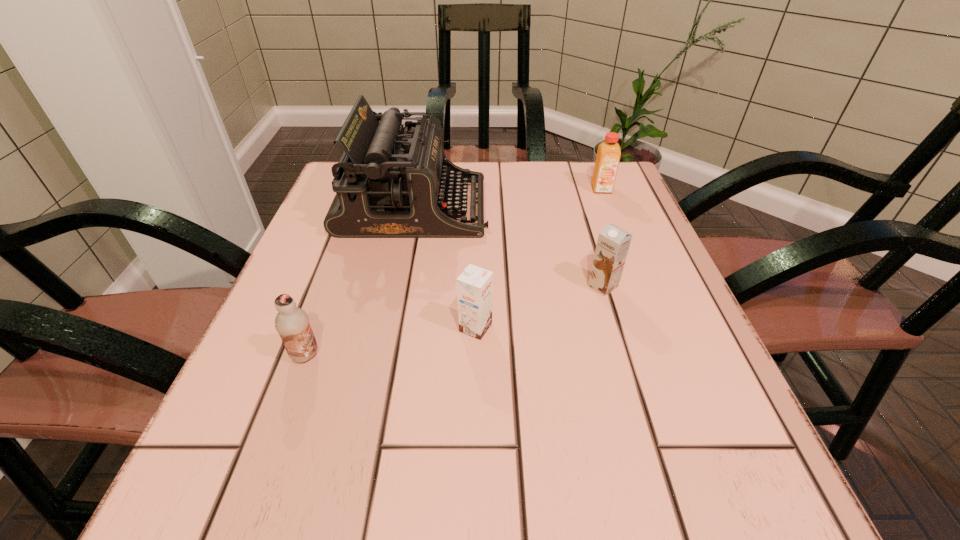
Find the location of a particular element. vacant space that satisfies the following two spatial constraints: 1. on the back side of the fourth farthest object; 2. on the left side of the leftmost chocolate milk is located at coordinates 316,328.

Locate an element on the screen. This screenshot has height=540, width=960. vacant region that satisfies the following two spatial constraints: 1. on the keyboard of the second nearest object; 2. on the left side of the typewriter is located at coordinates (390, 328).

Locate an element on the screen. free location that satisfies the following two spatial constraints: 1. on the keyboard of the typewriter; 2. on the front side of the leftmost chocolate milk is located at coordinates (384, 355).

This screenshot has width=960, height=540. I want to click on vacant area that satisfies the following two spatial constraints: 1. on the back side of the fourth object from left to right; 2. on the keyboard of the tallest object, so click(x=579, y=207).

You are a GUI agent. You are given a task and a screenshot of the screen. Output one action in this format:
    pyautogui.click(x=<x>, y=<y>)
    Task: Click on the blank area in the image that satisfies the following two spatial constraints: 1. on the back side of the rightmost chocolate milk; 2. on the left side of the nearest object
    This screenshot has height=540, width=960.
    Given the screenshot: What is the action you would take?
    pyautogui.click(x=330, y=286)